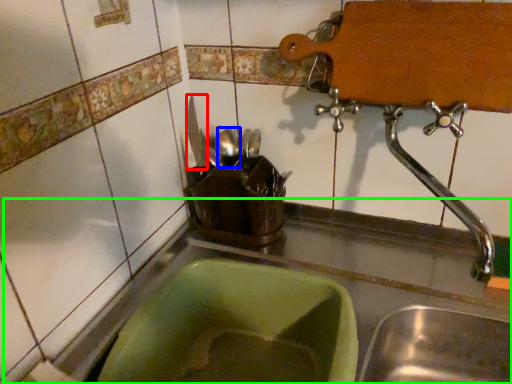
Question: Which is nearer to the tableware (highlighted by a red box)? tableware (highlighted by a blue box) or counter top (highlighted by a green box).

Choices:
 (A) tableware
 (B) counter top

Answer: (A)